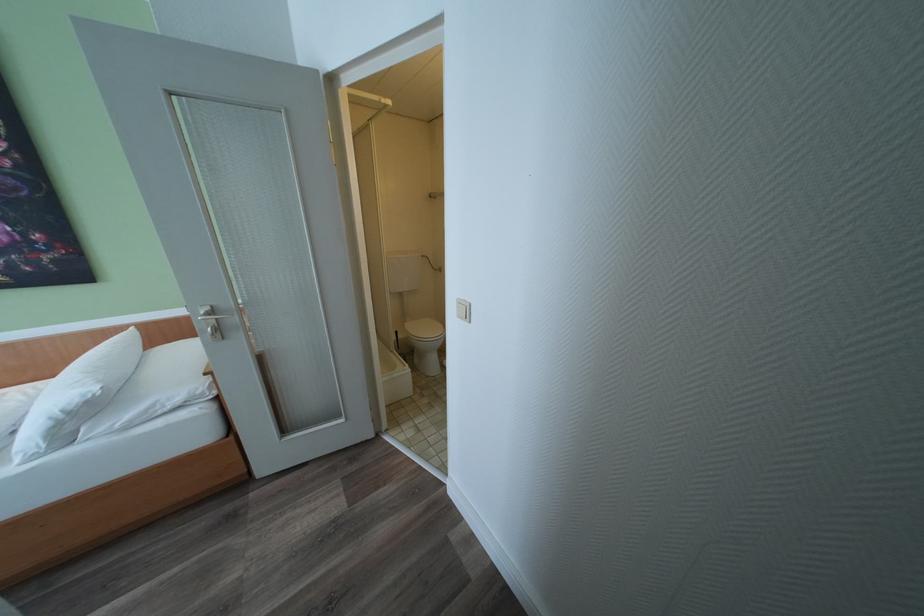
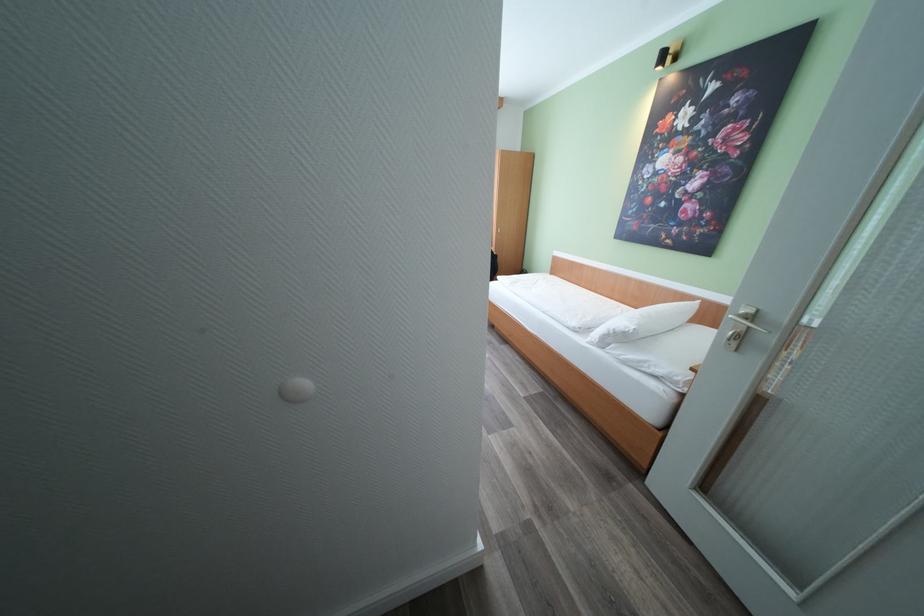
Locate, in the second image, the point that corresponds to (x=28, y=466) in the first image.

(593, 344)